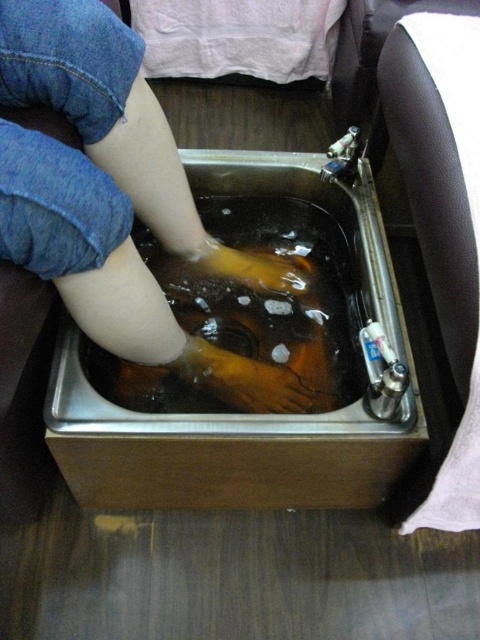
You are a robot trying to locate the smooth skin hand at center in the image. According to the coordinates given, where would you find it?

The smooth skin hand at center is located at the coordinates point (257, 385).

You are a therapist trying to place a client hand into the stainless steel sink at center. Can the smooth skin hand at center fit into the sink?

The stainless steel sink at center is wider than the smooth skin hand at center, so the hand can fit into the sink.

You need to place the yellow rubber glove at center into the stainless steel sink at center. Based on the scene description, will the glove fit inside the sink?

The stainless steel sink at center is wider than the yellow rubber glove at center, so the glove will fit inside the sink.